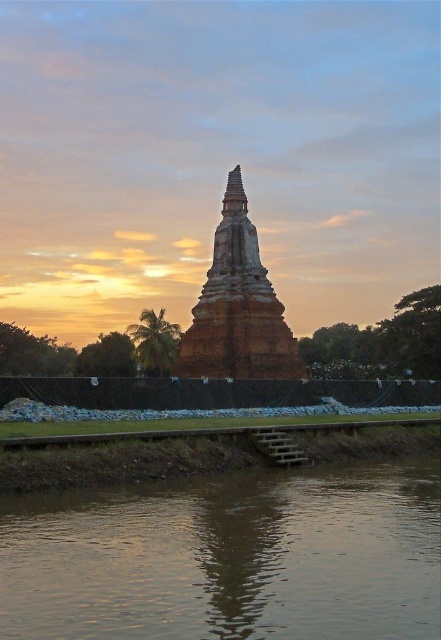
Which is behind, point (288, 589) or point (250, 227)?

Point (250, 227)

Can you confirm if brown muddy water at lower center is taller than brown textured stone tower at center?

In fact, brown muddy water at lower center may be shorter than brown textured stone tower at center.

Between point (100, 611) and point (213, 372), which one is positioned behind?

The point (213, 372) is more distant.

Locate an element on the screen. Image resolution: width=441 pixels, height=640 pixels. brown muddy water at lower center is located at coordinates (230, 557).